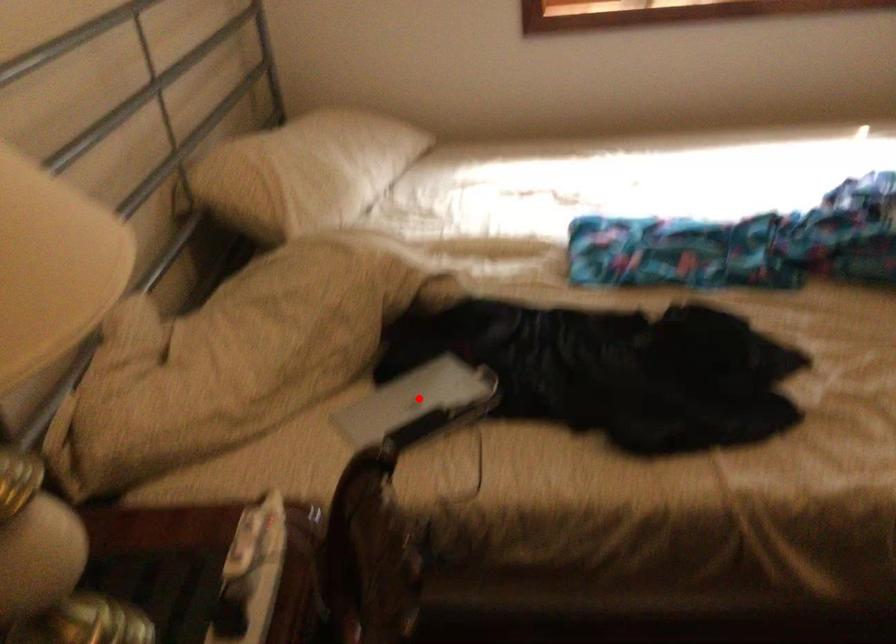
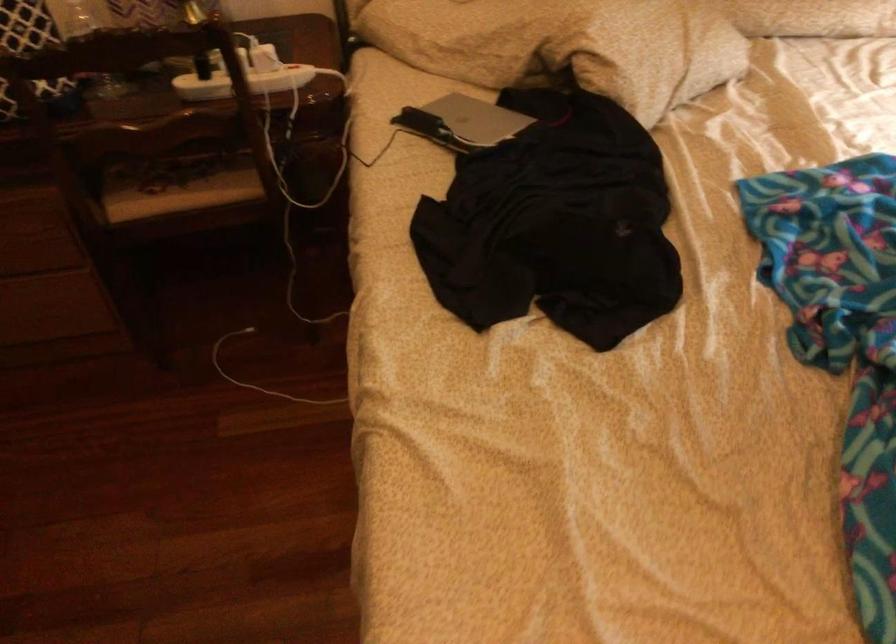
Question: I am providing you with two images of the same scene from different viewpoints. A red point is marked on the first image. At the location where the point appears in image 1, is it still visible in image 2?

Choices:
 (A) Yes
 (B) No

Answer: (A)